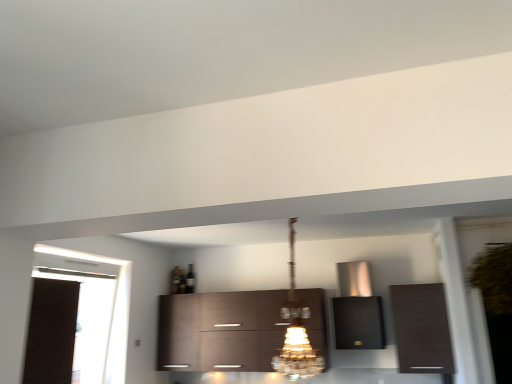
Question: Is black fabric curtain at left inside satin metallic range hood at center, the 2th cabinetry viewed from the left?

Choices:
 (A) yes
 (B) no

Answer: (B)

Question: From a real-world perspective, is satin metallic range hood at center, the 2th cabinetry viewed from the left, below black fabric curtain at left?

Choices:
 (A) no
 (B) yes

Answer: (A)

Question: Is satin metallic range hood at center, placed as the second cabinetry when sorted from right to left, oriented away from black fabric curtain at left?

Choices:
 (A) yes
 (B) no

Answer: (B)

Question: From a real-world perspective, is satin metallic range hood at center, placed as the second cabinetry when sorted from right to left, on top of black fabric curtain at left?

Choices:
 (A) yes
 (B) no

Answer: (A)

Question: Can you confirm if satin metallic range hood at center, the 2th cabinetry viewed from the left, is wider than black fabric curtain at left?

Choices:
 (A) yes
 (B) no

Answer: (A)

Question: From a real-world perspective, relative to satin metallic range hood at center, placed as the second cabinetry when sorted from right to left, is dark wood cabinet at right, the first cabinetry viewed from the right, vertically above or below?

Choices:
 (A) above
 (B) below

Answer: (B)

Question: Considering the positions of point click(414, 332) and point click(367, 347), is point click(414, 332) closer or farther from the camera than point click(367, 347)?

Choices:
 (A) farther
 (B) closer

Answer: (B)

Question: Based on their positions, is dark wood cabinet at right, the first cabinetry viewed from the right, located to the left or right of satin metallic range hood at center, the 2th cabinetry viewed from the left?

Choices:
 (A) right
 (B) left

Answer: (A)

Question: In the image, is dark wood cabinet at right, the first cabinetry viewed from the right, positioned in front of or behind satin metallic range hood at center, the 2th cabinetry viewed from the left?

Choices:
 (A) front
 (B) behind

Answer: (A)

Question: From the image's perspective, is satin metallic range hood at center, placed as the second cabinetry when sorted from right to left, located above or below crystal glass chandelier at center?

Choices:
 (A) below
 (B) above

Answer: (A)

Question: Is satin metallic range hood at center, placed as the second cabinetry when sorted from right to left, wider or thinner than crystal glass chandelier at center?

Choices:
 (A) thin
 (B) wide

Answer: (A)

Question: In terms of size, does satin metallic range hood at center, the 2th cabinetry viewed from the left, appear bigger or smaller than crystal glass chandelier at center?

Choices:
 (A) small
 (B) big

Answer: (A)

Question: From a real-world perspective, is satin metallic range hood at center, placed as the second cabinetry when sorted from right to left, physically located above or below crystal glass chandelier at center?

Choices:
 (A) above
 (B) below

Answer: (B)

Question: Considering the positions of dark wood cabinet at right, the first cabinetry viewed from the right, and black fabric curtain at left in the image, is dark wood cabinet at right, the first cabinetry viewed from the right, bigger or smaller than black fabric curtain at left?

Choices:
 (A) big
 (B) small

Answer: (B)

Question: Is dark wood cabinet at right, the first cabinetry viewed from the right, in front of or behind black fabric curtain at left in the image?

Choices:
 (A) behind
 (B) front

Answer: (A)